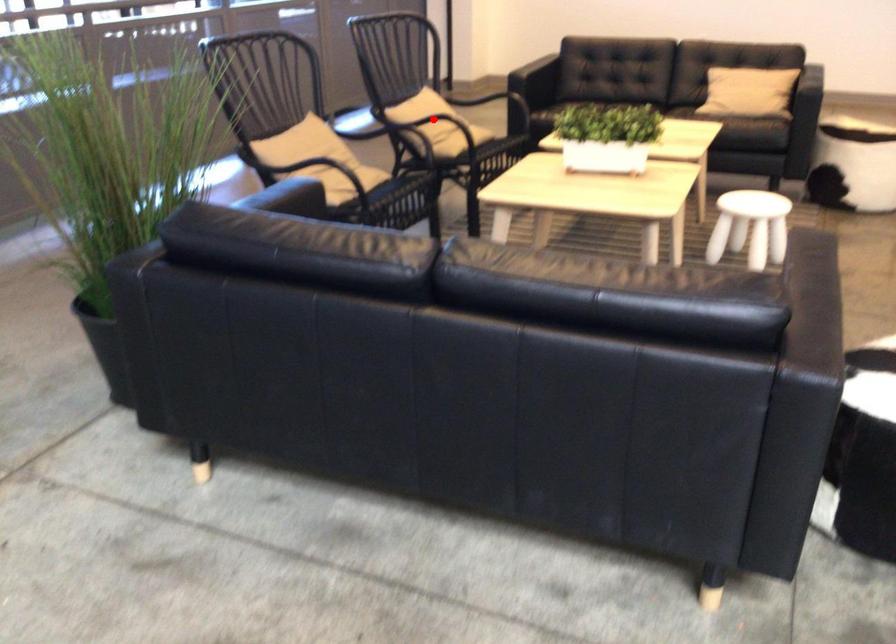
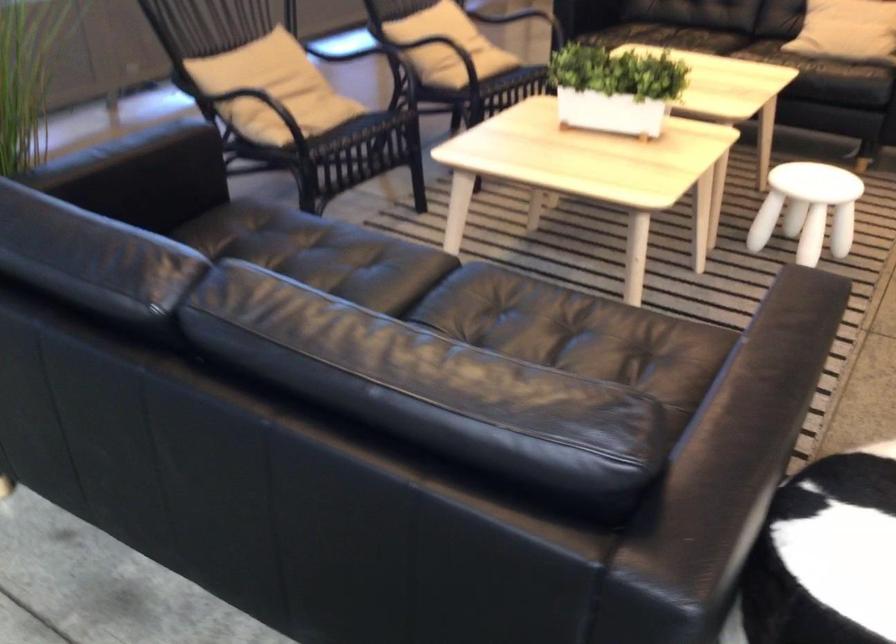
Where in the second image is the point corresponding to the highlighted location from the first image?

(433, 43)